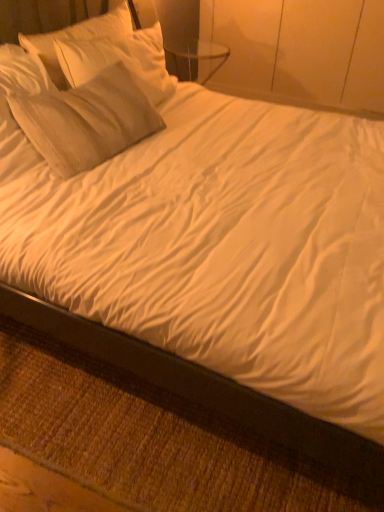
Describe the element at coordinates (76, 38) in the screenshot. I see `white soft pillow at upper left` at that location.

Measure the distance between white soft pillow at upper left and camera.

white soft pillow at upper left and camera are 1.67 meters apart.

This screenshot has height=512, width=384. I want to click on white soft pillow at upper left, so click(76, 38).

What do you see at coordinates (204, 394) in the screenshot? I see `black wood bed frame at lower left` at bounding box center [204, 394].

Locate an element on the screen. black wood bed frame at lower left is located at coordinates (204, 394).

From the picture: Measure the distance between black wood bed frame at lower left and camera.

The depth of black wood bed frame at lower left is 35.08 inches.

You are a GUI agent. You are given a task and a screenshot of the screen. Output one action in this format:
    pyautogui.click(x=<x>, y=<y>)
    Task: Click on the white soft pillow at upper left
    
    Given the screenshot: What is the action you would take?
    pyautogui.click(x=76, y=38)

Considering the positions of objects black wood bed frame at lower left and white soft pillow at upper left in the image provided, who is more to the right, black wood bed frame at lower left or white soft pillow at upper left?

black wood bed frame at lower left.

Considering their positions, is black wood bed frame at lower left located in front of or behind white soft pillow at upper left?

black wood bed frame at lower left is in front of white soft pillow at upper left.

Between point (43, 317) and point (106, 22), which one is positioned in front?

Point (43, 317)

From the image's perspective, between black wood bed frame at lower left and white soft pillow at upper left, who is located below?

black wood bed frame at lower left.

From a real-world perspective, is black wood bed frame at lower left located higher than white soft pillow at upper left?

No, from a real-world perspective, black wood bed frame at lower left is not on top of white soft pillow at upper left.

Considering the sizes of objects black wood bed frame at lower left and white soft pillow at upper left in the image provided, who is thinner, black wood bed frame at lower left or white soft pillow at upper left?

white soft pillow at upper left is thinner.

Which of these two, black wood bed frame at lower left or white soft pillow at upper left, stands taller?

white soft pillow at upper left is taller.

Can you confirm if black wood bed frame at lower left is bigger than white soft pillow at upper left?

Actually, black wood bed frame at lower left might be smaller than white soft pillow at upper left.

Is black wood bed frame at lower left inside or outside of white soft pillow at upper left?

black wood bed frame at lower left is outside white soft pillow at upper left.

Would you say black wood bed frame at lower left is a long distance from white soft pillow at upper left?

Yes.

Is black wood bed frame at lower left oriented towards white soft pillow at upper left?

No.

At what (x,y) coordinates should I click in order to perform the action: click on pillow above the black wood bed frame at lower left (from a real-world perspective). Please return your answer as a coordinate pair (x, y). The width and height of the screenshot is (384, 512). Looking at the image, I should click on (76, 38).

Consider the image. Would you say white soft pillow at upper left is to the left or to the right of black wood bed frame at lower left in the picture?

Clearly, white soft pillow at upper left is on the left of black wood bed frame at lower left in the image.

Is white soft pillow at upper left further to the viewer compared to black wood bed frame at lower left?

Yes.

Considering the positions of point (52, 40) and point (307, 432), is point (52, 40) closer or farther from the camera than point (307, 432)?

Point (52, 40).

From the image's perspective, is white soft pillow at upper left on black wood bed frame at lower left?

Yes, from the image's perspective, white soft pillow at upper left is above black wood bed frame at lower left.

From a real-world perspective, is white soft pillow at upper left below black wood bed frame at lower left?

No.

Looking at their sizes, would you say white soft pillow at upper left is wider or thinner than black wood bed frame at lower left?

In the image, white soft pillow at upper left appears to be more narrow than black wood bed frame at lower left.

Considering the relative sizes of white soft pillow at upper left and black wood bed frame at lower left in the image provided, is white soft pillow at upper left shorter than black wood bed frame at lower left?

No.

Considering the sizes of objects white soft pillow at upper left and black wood bed frame at lower left in the image provided, who is smaller, white soft pillow at upper left or black wood bed frame at lower left?

Smaller between the two is black wood bed frame at lower left.

Is black wood bed frame at lower left a part of white soft pillow at upper left?

No.

Are white soft pillow at upper left and black wood bed frame at lower left beside each other?

No, white soft pillow at upper left is not making contact with black wood bed frame at lower left.

Consider the image. Is white soft pillow at upper left aimed at black wood bed frame at lower left?

No, white soft pillow at upper left is not oriented towards black wood bed frame at lower left.

What's the angular difference between white soft pillow at upper left and black wood bed frame at lower left's facing directions?

The angular difference between white soft pillow at upper left and black wood bed frame at lower left is 178 degrees.

Where is `bed frame to the right of white soft pillow at upper left`? The width and height of the screenshot is (384, 512). bed frame to the right of white soft pillow at upper left is located at coordinates (204, 394).

In the image, there is a black wood bed frame at lower left. Where is `pillow above it (from the image's perspective)`? pillow above it (from the image's perspective) is located at coordinates (76, 38).

At what (x,y) coordinates should I click in order to perform the action: click on pillow above the black wood bed frame at lower left (from a real-world perspective). Please return your answer as a coordinate pair (x, y). This screenshot has height=512, width=384. Looking at the image, I should click on (76, 38).